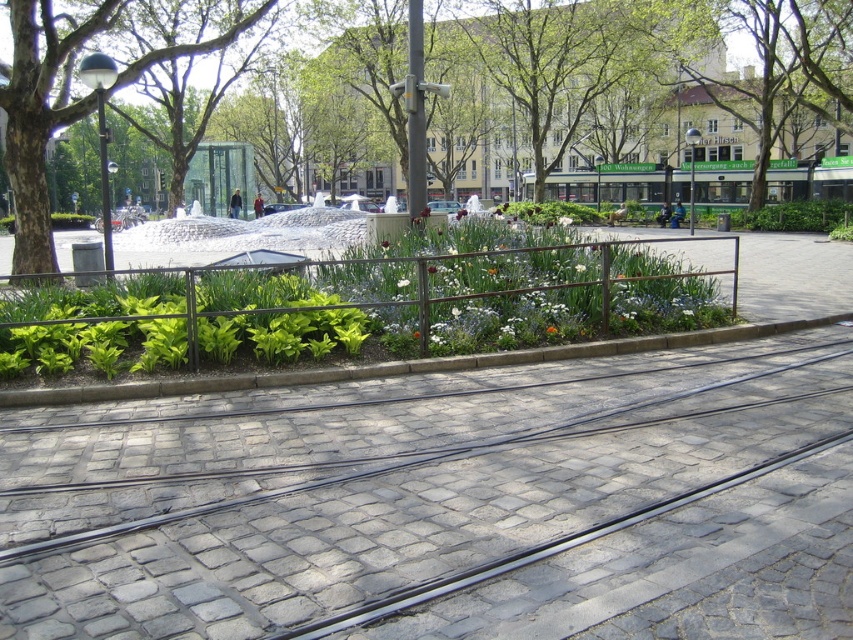
Question: Does green leafy tree at left have a lesser width compared to green leafy tree at upper center?

Choices:
 (A) yes
 (B) no

Answer: (A)

Question: Which of the following is the closest to the observer?

Choices:
 (A) green leafy tree at center
 (B) gray cobblestone train track at center
 (C) green leafy tree at upper center

Answer: (B)

Question: Is green leafy tree at center bigger than green leafy tree at left?

Choices:
 (A) yes
 (B) no

Answer: (A)

Question: Which object appears closest to the camera in this image?

Choices:
 (A) green leafy tree at center
 (B) green leafy tree at left
 (C) green leafy tree at upper center

Answer: (B)

Question: Which point is closer to the camera taking this photo?

Choices:
 (A) (120, 76)
 (B) (793, 102)

Answer: (A)

Question: Does green leafy tree at left come in front of green leafy tree at upper center?

Choices:
 (A) no
 (B) yes

Answer: (B)